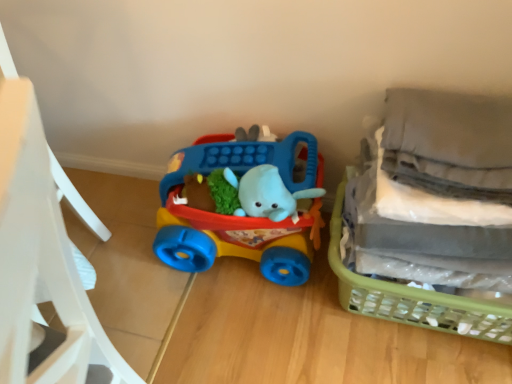
Question: Is matte plastic toy car at center positioned far away from green plastic basket at right?

Choices:
 (A) no
 (B) yes

Answer: (A)

Question: From a real-world perspective, is matte plastic toy car at center over green plastic basket at right?

Choices:
 (A) yes
 (B) no

Answer: (A)

Question: Can you confirm if matte plastic toy car at center is wider than green plastic basket at right?

Choices:
 (A) no
 (B) yes

Answer: (A)

Question: Considering the relative positions of matte plastic toy car at center and green plastic basket at right in the image provided, is matte plastic toy car at center behind green plastic basket at right?

Choices:
 (A) yes
 (B) no

Answer: (A)

Question: From the image's perspective, is matte plastic toy car at center below green plastic basket at right?

Choices:
 (A) no
 (B) yes

Answer: (A)

Question: In the image, is green plastic basket at right on the left side or the right side of matte plastic chair at left?

Choices:
 (A) right
 (B) left

Answer: (A)

Question: Which is correct: green plastic basket at right is inside matte plastic chair at left, or outside of it?

Choices:
 (A) inside
 (B) outside

Answer: (B)

Question: From a real-world perspective, relative to matte plastic chair at left, is green plastic basket at right vertically above or below?

Choices:
 (A) below
 (B) above

Answer: (A)

Question: Is point (400, 299) closer or farther from the camera than point (12, 97)?

Choices:
 (A) farther
 (B) closer

Answer: (A)

Question: Is green plastic basket at right wider or thinner than matte plastic toy car at center?

Choices:
 (A) wide
 (B) thin

Answer: (A)

Question: From the image's perspective, relative to matte plastic toy car at center, is green plastic basket at right above or below?

Choices:
 (A) above
 (B) below

Answer: (B)

Question: From their relative heights in the image, would you say green plastic basket at right is taller or shorter than matte plastic toy car at center?

Choices:
 (A) short
 (B) tall

Answer: (A)

Question: Would you say green plastic basket at right is to the left or to the right of matte plastic toy car at center in the picture?

Choices:
 (A) left
 (B) right

Answer: (B)

Question: From the image's perspective, is matte plastic toy car at center located above or below matte plastic chair at left?

Choices:
 (A) below
 (B) above

Answer: (B)

Question: In terms of width, does matte plastic toy car at center look wider or thinner when compared to matte plastic chair at left?

Choices:
 (A) wide
 (B) thin

Answer: (B)